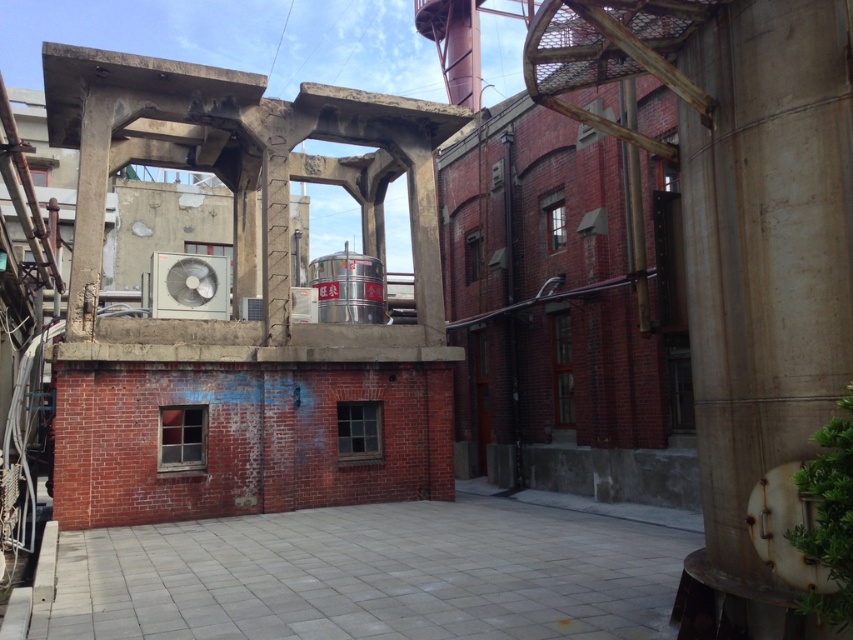
Question: Can you confirm if smooth concrete pillar at center right is wider than gray concrete alley at center?

Choices:
 (A) no
 (B) yes

Answer: (A)

Question: Which object appears closest to the camera in this image?

Choices:
 (A) gray concrete alley at center
 (B) smooth concrete pillar at center right

Answer: (B)

Question: Which object is farther from the camera taking this photo?

Choices:
 (A) smooth concrete pillar at center right
 (B) gray concrete alley at center

Answer: (B)

Question: Can you confirm if smooth concrete pillar at center right is wider than gray concrete alley at center?

Choices:
 (A) no
 (B) yes

Answer: (A)

Question: Which point appears closest to the camera in this image?

Choices:
 (A) (840, 150)
 (B) (61, 589)

Answer: (A)

Question: Is smooth concrete pillar at center right to the right of gray concrete alley at center from the viewer's perspective?

Choices:
 (A) yes
 (B) no

Answer: (A)